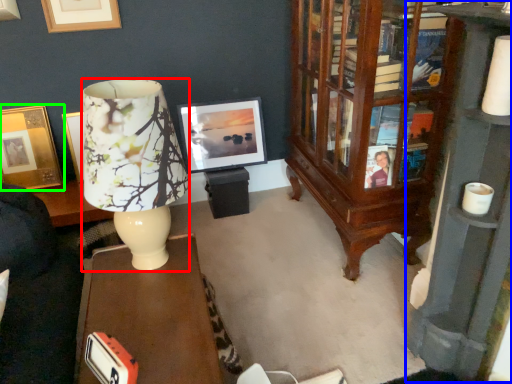
Question: Which object is positioned closest to lamp (highlighted by a red box)? Select from bookcase (highlighted by a blue box) and picture frame (highlighted by a green box).

Choices:
 (A) bookcase
 (B) picture frame

Answer: (A)